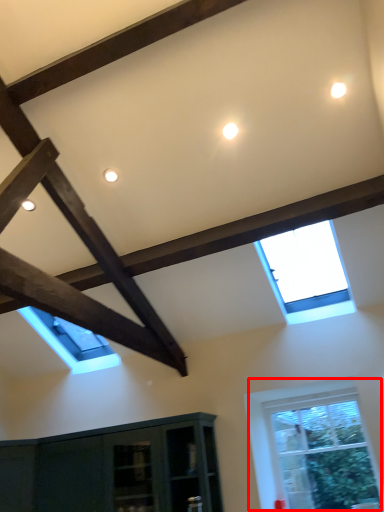
Question: In this image, where is window (annotated by the red box) located relative to window?

Choices:
 (A) left
 (B) right

Answer: (B)